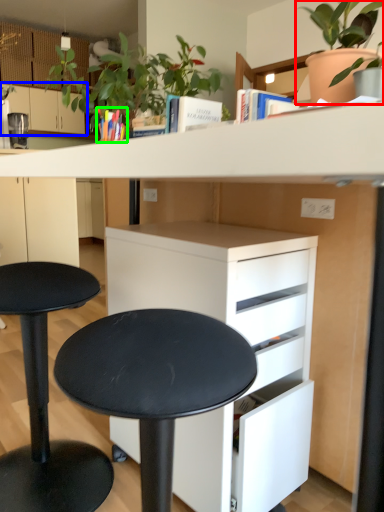
Question: Which object is positioned farthest from houseplant (highlighted by a red box)? Select from cabinetry (highlighted by a blue box) and book (highlighted by a green box).

Choices:
 (A) cabinetry
 (B) book

Answer: (A)